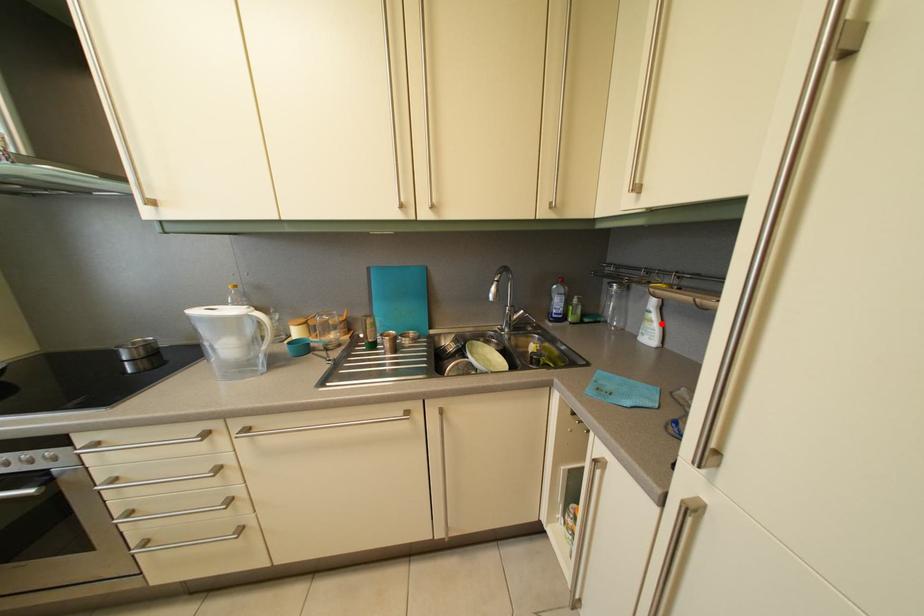
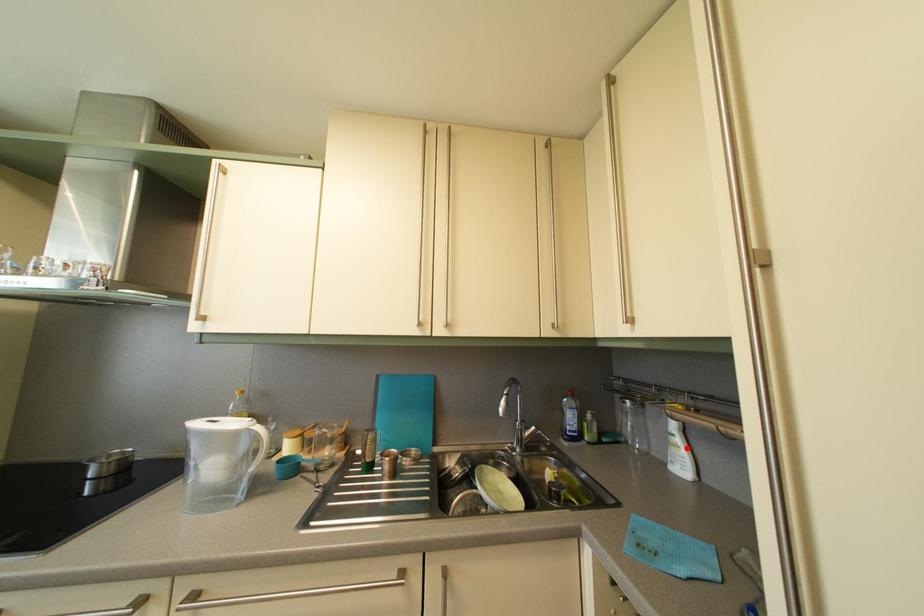
I am providing you with two images of the same scene from different viewpoints. A red point is marked on the first image and another point is marked on the second image. Is the marked point in image1 the same physical position as the marked point in image2?

Yes